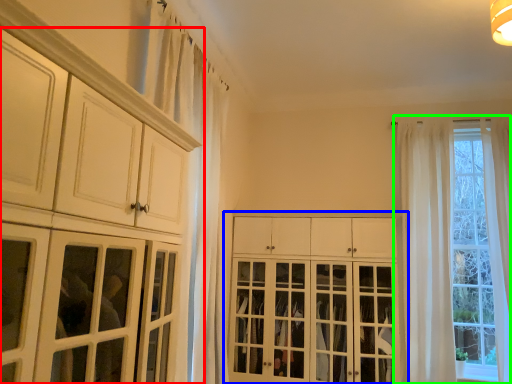
Question: Which object is positioned farthest from cabinetry (highlighted by a red box)? Select from cabinetry (highlighted by a blue box) and window (highlighted by a green box).

Choices:
 (A) cabinetry
 (B) window

Answer: (B)